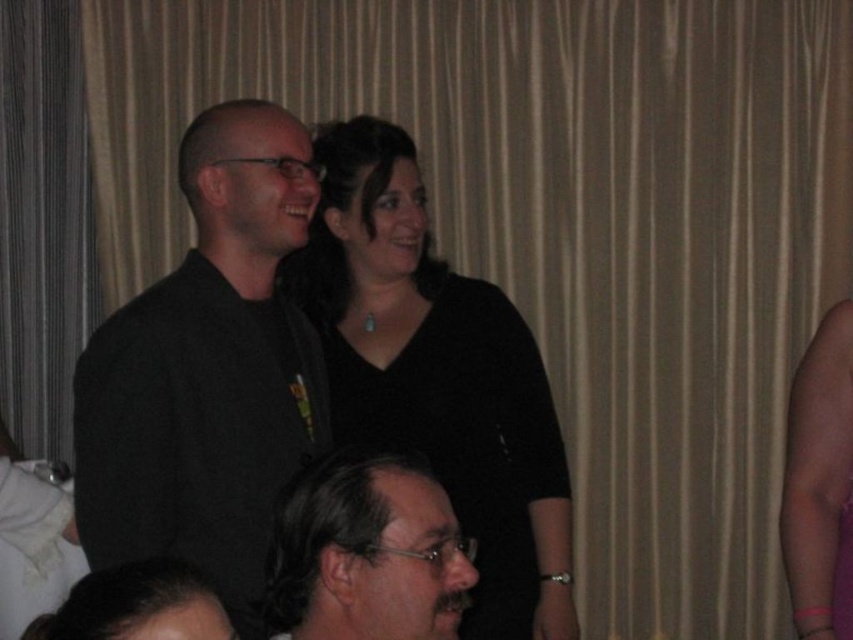
You are at a social event and want to take a photo of the black matte shirt at center and the dark brown hair at lower center. Which object should you focus on first if you want to capture both in the same frame without moving the camera?

The black matte shirt at center is above dark brown hair at lower center, so you should focus on the black matte shirt at center first to ensure both are in the frame.

You are at a social event and want to introduce yourself to the person wearing the black matte shirt at center. To do so, should you approach towards the left or right side of the dark brown hair at lower center?

The black matte shirt at center is to the right of the dark brown hair at lower center, so you should approach towards the right side of the dark brown hair at lower center to reach the person wearing the black matte shirt at center.